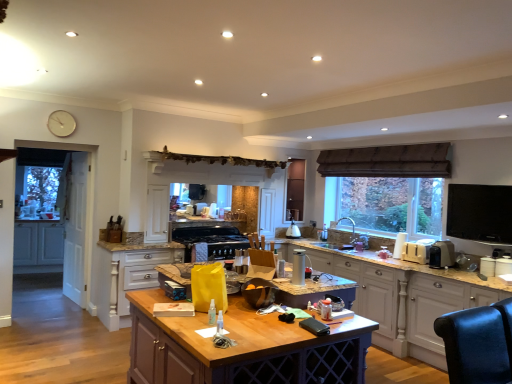
Question: From a real-world perspective, is white plastic toaster at right, which is the third appliance from front to back, beneath black glass stove at center, placed as the 4th appliance when sorted from right to left?

Choices:
 (A) no
 (B) yes

Answer: (A)

Question: Is white plastic toaster at right, which is the 3th appliance in left-to-right order, further to camera compared to black glass stove at center, which is counted as the 1th appliance, starting from the left?

Choices:
 (A) yes
 (B) no

Answer: (B)

Question: Is white plastic toaster at right, which is the 3th appliance in left-to-right order, turned away from black glass stove at center, placed as the 4th appliance when sorted from right to left?

Choices:
 (A) yes
 (B) no

Answer: (B)

Question: Is white plastic toaster at right, which is the 3th appliance in left-to-right order, at the left side of black glass stove at center, which is counted as the 1th appliance, starting from the left?

Choices:
 (A) yes
 (B) no

Answer: (B)

Question: Is black glass stove at center, the 4th appliance viewed from the front, completely or partially inside white plastic toaster at right, which is the 3th appliance in left-to-right order?

Choices:
 (A) yes
 (B) no

Answer: (B)

Question: Is white plastic toaster at right, which is the third appliance from front to back, located outside black glass stove at center, the 4th appliance viewed from the front?

Choices:
 (A) no
 (B) yes

Answer: (B)

Question: Is white matte clock at upper left turned away from white wood cabinetry at right, which is the 3th cabinetry from left to right?

Choices:
 (A) no
 (B) yes

Answer: (A)

Question: Considering the relative sizes of white matte clock at upper left and white wood cabinetry at right, the 1th cabinetry when ordered from right to left, in the image provided, is white matte clock at upper left smaller than white wood cabinetry at right, the 1th cabinetry when ordered from right to left,?

Choices:
 (A) yes
 (B) no

Answer: (A)

Question: Is white matte clock at upper left outside white wood cabinetry at right, which is the 3th cabinetry from left to right?

Choices:
 (A) no
 (B) yes

Answer: (B)

Question: Considering the relative positions of white matte clock at upper left and white wood cabinetry at right, placed as the third cabinetry when sorted from back to front, in the image provided, is white matte clock at upper left to the right of white wood cabinetry at right, placed as the third cabinetry when sorted from back to front, from the viewer's perspective?

Choices:
 (A) no
 (B) yes

Answer: (A)

Question: Is white matte clock at upper left closer to the viewer compared to white wood cabinetry at right, which is the 3th cabinetry from left to right?

Choices:
 (A) yes
 (B) no

Answer: (B)

Question: From a real-world perspective, is white matte clock at upper left positioned under white wood cabinetry at right, the 1th cabinetry when ordered from right to left, based on gravity?

Choices:
 (A) no
 (B) yes

Answer: (A)

Question: From a real-world perspective, is black glass stove at center, the 4th appliance viewed from the front, located higher than matte white cabinets at left, the 1th cabinetry viewed from the back?

Choices:
 (A) yes
 (B) no

Answer: (A)